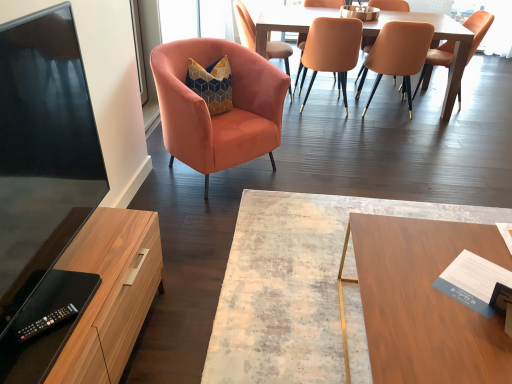
This screenshot has height=384, width=512. Identify the location of free point below matte black tv at left (from a real-world perspective). (74, 265).